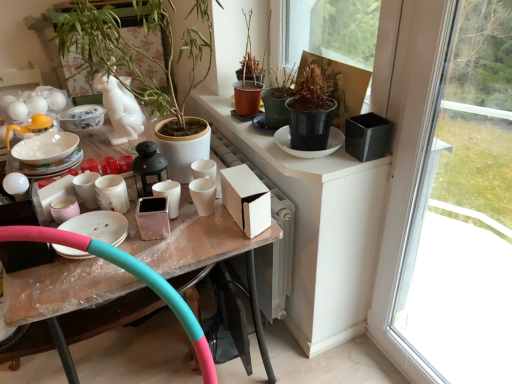
Where is `empty space that is to the right of matte pink ceramic cup at center, marked as the 1th tableware in a right-to-left arrangement`? This screenshot has width=512, height=384. empty space that is to the right of matte pink ceramic cup at center, marked as the 1th tableware in a right-to-left arrangement is located at coordinates (212, 229).